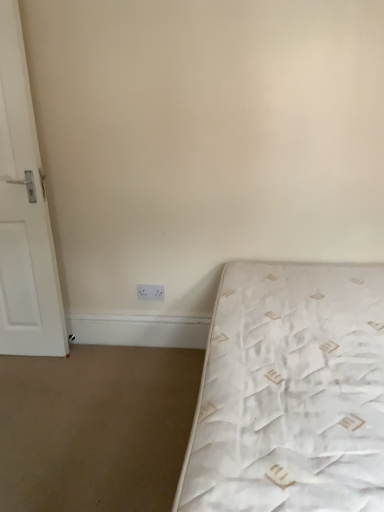
Identify the location of vacant space to the right of white matte door at left. The height and width of the screenshot is (512, 384). (77, 362).